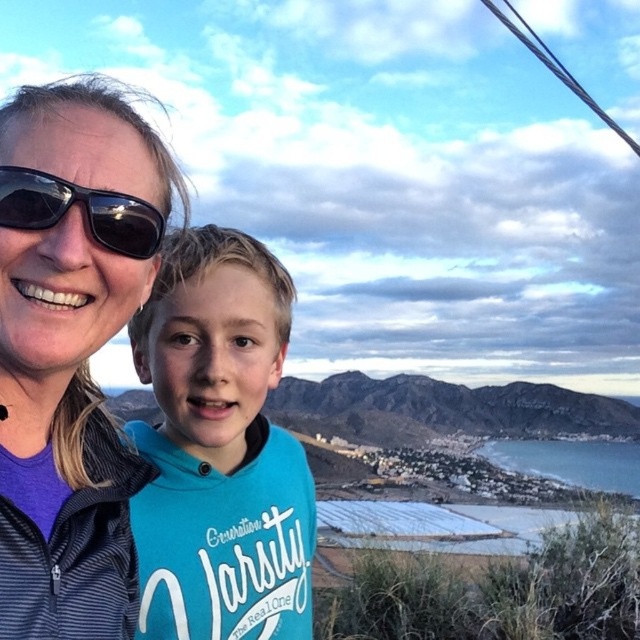
You are a photographer trying to capture the perfect shot of the teal jersey at center in the coastal landscape. Given the coordinates provided, where should you position your camera relative to the two people in the foreground to ensure the jersey is centered in your frame?

The teal jersey at center is located at coordinates point (220, 449). To center it in your frame, position your camera so that the jersey aligns with the center point of your viewfinder or screen, which corresponds to the given coordinates.

In the scene shown: You are a photographer trying to capture a photo of both the matte black jacket at upper left and the teal jersey at center. Based on their positions, which one would appear larger in your camera viewfinder?

The matte black jacket at upper left appears larger in the camera viewfinder because it is closer to the viewer than the teal jersey at center.

You are taking a photo of the two people in the scene. The matte black jacket at upper left and the black plastic sunglasses at upper left are both in the frame. If you want to ensure both items are fully visible, which item requires more space horizontally in the photo?

The matte black jacket at upper left requires more space horizontally in the photo because its width is larger than the black plastic sunglasses at upper left.